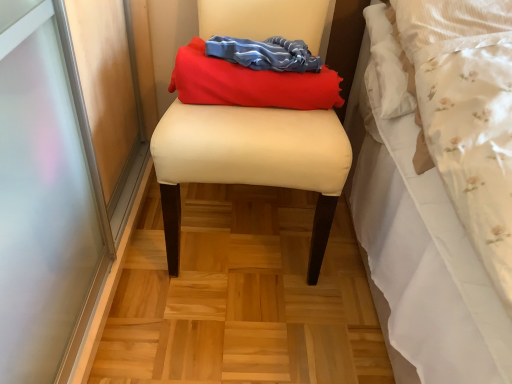
Question: Would you say beige fabric stool at center is to the left or to the right of matte red fabric at center in the picture?

Choices:
 (A) left
 (B) right

Answer: (A)

Question: Does point (232, 23) appear closer or farther from the camera than point (223, 46)?

Choices:
 (A) farther
 (B) closer

Answer: (A)

Question: Is beige fabric stool at center situated inside matte red fabric at center or outside?

Choices:
 (A) inside
 (B) outside

Answer: (B)

Question: Which is correct: matte red fabric at center is inside beige fabric stool at center, or outside of it?

Choices:
 (A) outside
 (B) inside

Answer: (B)

Question: Considering the positions of point (305, 91) and point (270, 110), is point (305, 91) closer or farther from the camera than point (270, 110)?

Choices:
 (A) farther
 (B) closer

Answer: (B)

Question: From a real-world perspective, relative to beige fabric stool at center, is matte red fabric at center vertically above or below?

Choices:
 (A) above
 (B) below

Answer: (A)

Question: In the image, is matte red fabric at center positioned in front of or behind beige fabric stool at center?

Choices:
 (A) behind
 (B) front

Answer: (A)